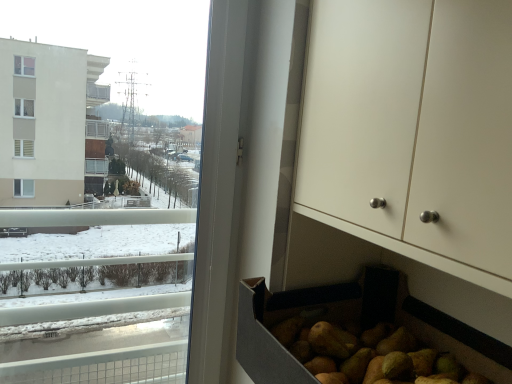
This screenshot has height=384, width=512. I want to click on white matte cabinet at lower right, so click(x=413, y=130).

What do you see at coordinates (413, 130) in the screenshot? The height and width of the screenshot is (384, 512). I see `white matte cabinet at lower right` at bounding box center [413, 130].

This screenshot has width=512, height=384. What do you see at coordinates (101, 209) in the screenshot? I see `transparent glass window at left` at bounding box center [101, 209].

Where is `transparent glass window at left`? The width and height of the screenshot is (512, 384). transparent glass window at left is located at coordinates (101, 209).

Locate an element on the screen. white matte cabinet at lower right is located at coordinates (413, 130).

Which is more to the right, white matte cabinet at lower right or transparent glass window at left?

Positioned to the right is white matte cabinet at lower right.

Considering their positions, is white matte cabinet at lower right located in front of or behind transparent glass window at left?

white matte cabinet at lower right is positioned closer to the viewer than transparent glass window at left.

Is point (326, 57) positioned after point (24, 42)?

No, it is not.

From the image's perspective, which object appears higher, white matte cabinet at lower right or transparent glass window at left?

From the image's view, white matte cabinet at lower right is above.

From a real-world perspective, is white matte cabinet at lower right located beneath transparent glass window at left?

No, from a real-world perspective, white matte cabinet at lower right is not beneath transparent glass window at left.

Considering the relative sizes of white matte cabinet at lower right and transparent glass window at left in the image provided, is white matte cabinet at lower right wider than transparent glass window at left?

Indeed, white matte cabinet at lower right has a greater width compared to transparent glass window at left.

Is white matte cabinet at lower right taller than transparent glass window at left?

No.

Who is smaller, white matte cabinet at lower right or transparent glass window at left?

With smaller size is transparent glass window at left.

Is white matte cabinet at lower right inside or outside of transparent glass window at left?

white matte cabinet at lower right is not enclosed by transparent glass window at left.

Are white matte cabinet at lower right and transparent glass window at left making contact?

white matte cabinet at lower right and transparent glass window at left are not in contact.

Is white matte cabinet at lower right aimed at transparent glass window at left?

No.

Can you tell me how much white matte cabinet at lower right and transparent glass window at left differ in facing direction?

90.1 degrees.

Identify the location of dresser above the transparent glass window at left (from the image's perspective). (413, 130).

Based on the photo, which object is positioned more to the right, transparent glass window at left or white matte cabinet at lower right?

white matte cabinet at lower right is more to the right.

Is transparent glass window at left in front of or behind white matte cabinet at lower right in the image?

transparent glass window at left is behind white matte cabinet at lower right.

Is point (142, 365) positioned behind point (430, 122)?

Yes, it is.

From the image's perspective, is transparent glass window at left under white matte cabinet at lower right?

Correct, transparent glass window at left appears lower than white matte cabinet at lower right in the image.

From a real-world perspective, which object rests below the other?

From a 3D spatial view, transparent glass window at left is below.

Between transparent glass window at left and white matte cabinet at lower right, which one has smaller width?

With smaller width is transparent glass window at left.

Considering the relative sizes of transparent glass window at left and white matte cabinet at lower right in the image provided, is transparent glass window at left shorter than white matte cabinet at lower right?

No, transparent glass window at left is not shorter than white matte cabinet at lower right.

Is transparent glass window at left smaller than white matte cabinet at lower right?

Indeed, transparent glass window at left has a smaller size compared to white matte cabinet at lower right.

Is transparent glass window at left not inside white matte cabinet at lower right?

Indeed, transparent glass window at left is completely outside white matte cabinet at lower right.

Is the surface of transparent glass window at left in direct contact with white matte cabinet at lower right?

No, transparent glass window at left is not in contact with white matte cabinet at lower right.

Is transparent glass window at left looking in the opposite direction of white matte cabinet at lower right?

No, transparent glass window at left's orientation is not away from white matte cabinet at lower right.

I want to click on dresser that is in front of the transparent glass window at left, so click(413, 130).

Find the location of a particular element. The width and height of the screenshot is (512, 384). dresser located above the transparent glass window at left (from the image's perspective) is located at coordinates (413, 130).

At what (x,y) coordinates should I click in order to perform the action: click on dresser in front of the transparent glass window at left. Please return your answer as a coordinate pair (x, y). This screenshot has width=512, height=384. Looking at the image, I should click on (413, 130).